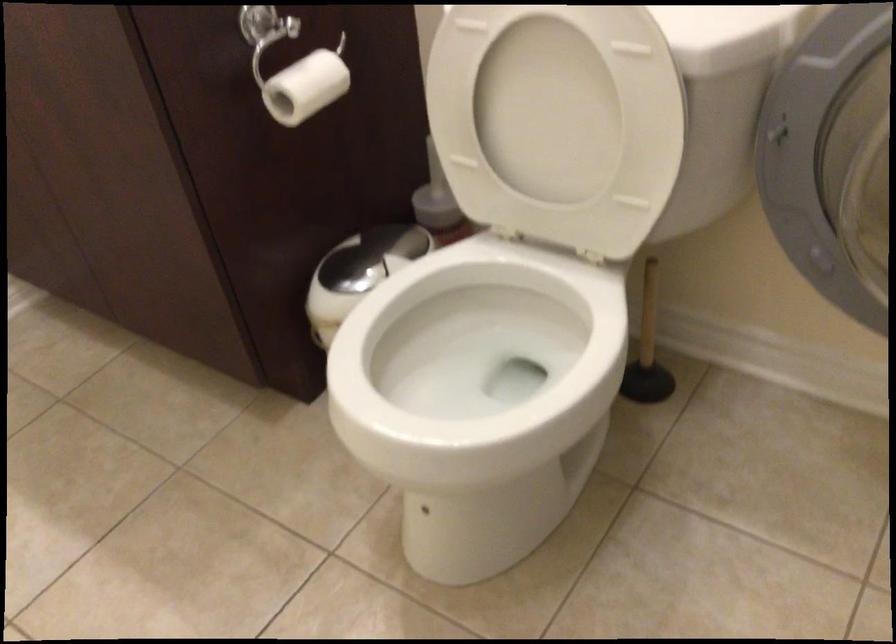
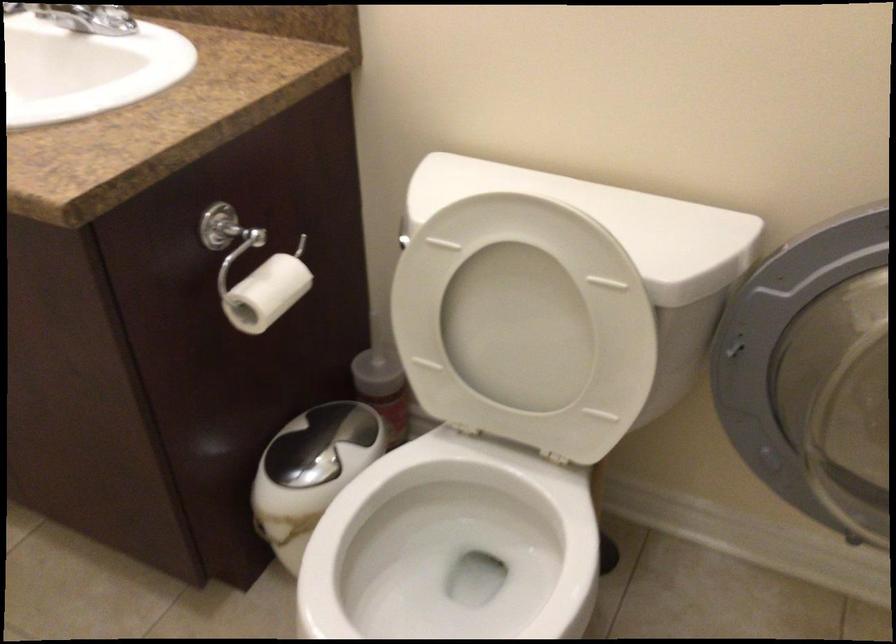
Find the pixel in the second image that matches (487,368) in the first image.

(449, 564)